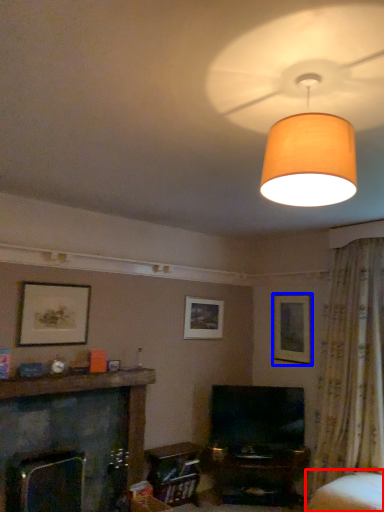
Question: Which object is further to the camera taking this photo, swivel chair (highlighted by a red box) or picture frame (highlighted by a blue box)?

Choices:
 (A) swivel chair
 (B) picture frame

Answer: (B)